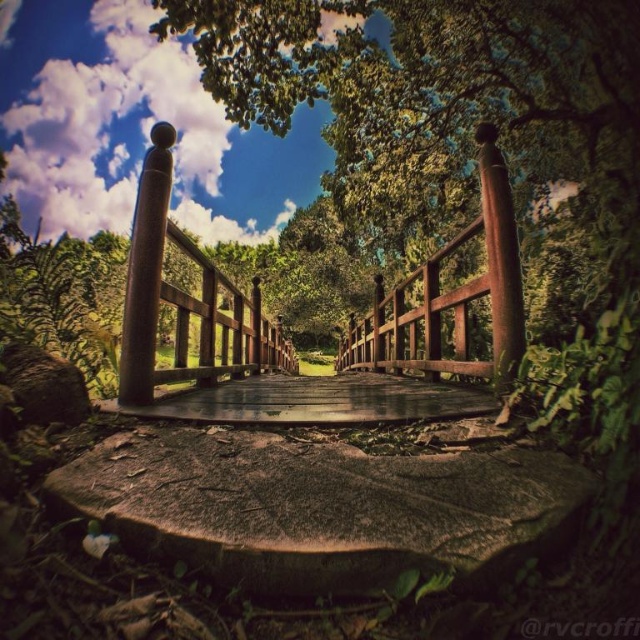
You are standing at the base of the wooden bridge at center and want to walk towards the brown polished wood post at center. Which direction should you move to reach it?

The wooden bridge at center is to the right of the brown polished wood post at center, so to reach the post, you should move to the left.